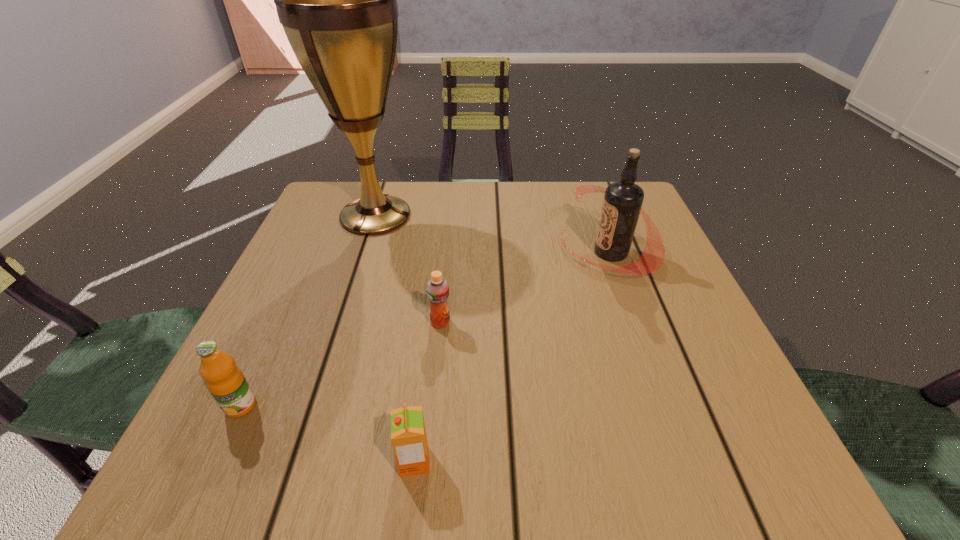
Identify the location of free space between the farthest orange juice and the nearest object. This screenshot has width=960, height=540. (427, 392).

This screenshot has width=960, height=540. In order to click on free space that is in between the nearest object and the trophy cup in this screenshot , I will do `click(395, 339)`.

Locate an element on the screen. free area in between the leftmost orange juice and the nearest object is located at coordinates (327, 433).

Identify the location of vacant space that's between the trophy cup and the farthest orange juice. The width and height of the screenshot is (960, 540). (408, 269).

The height and width of the screenshot is (540, 960). I want to click on free space between the nearest object and the farthest orange juice, so click(427, 392).

Where is `free space between the second farthest orange juice and the third nearest object`? free space between the second farthest orange juice and the third nearest object is located at coordinates (341, 364).

Identify the location of unoccupied position between the leftmost orange juice and the nearest object. (327, 433).

Identify the location of unoccupied area between the trophy cup and the nearest object. The width and height of the screenshot is (960, 540). click(395, 339).

The image size is (960, 540). Identify the location of unoccupied position between the second nearest object and the root beer. (425, 329).

Where is `object that can be found as the second closest to the second farthest orange juice`? The height and width of the screenshot is (540, 960). object that can be found as the second closest to the second farthest orange juice is located at coordinates (437, 288).